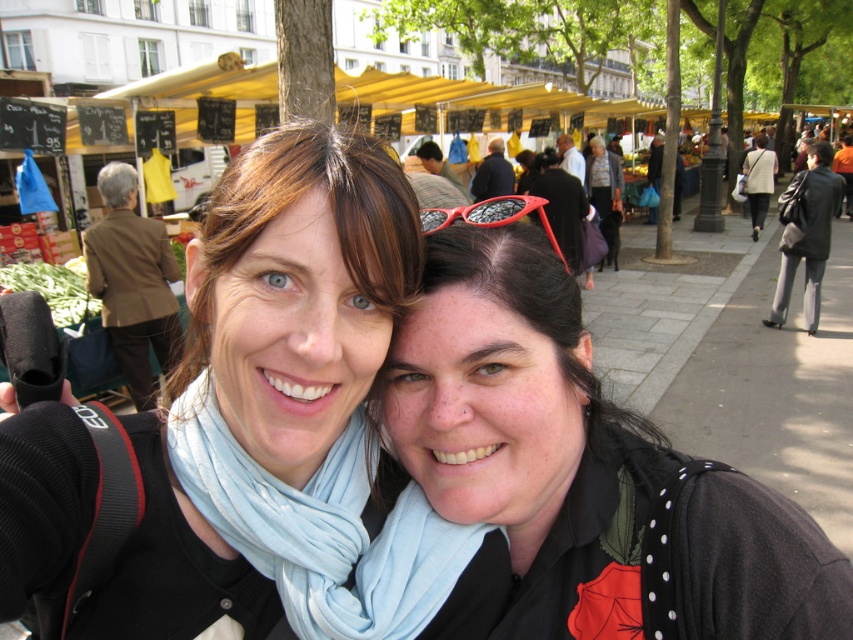
You are a fashion designer observing the two people in the center of the image. You need to determine which clothing item is positioned higher on their bodies between the matte black shirt at center and the light blue fabric scarf at center. Which one is higher?

The matte black shirt at center is located above the light blue fabric scarf at center, so the matte black shirt at center is positioned higher on their bodies.

You are standing at the entrance of the market and want to locate the matte black shirt at center. According to the coordinates provided, in which direction should you look relative to your current position?

You should look towards the coordinates point at 0.733 on the horizontal axis and 0.687 on the vertical axis to find the matte black shirt at center.